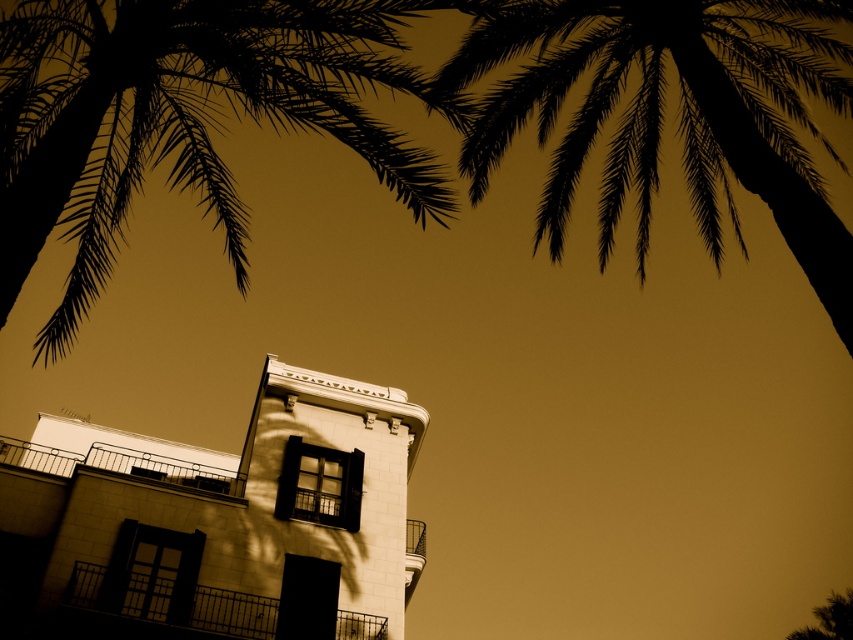
Is silhouette leafy palm at upper left shorter than black silhouette palm tree at upper right?

Indeed, silhouette leafy palm at upper left has a lesser height compared to black silhouette palm tree at upper right.

Is silhouette leafy palm at upper left wider than black silhouette palm tree at upper right?

In fact, silhouette leafy palm at upper left might be narrower than black silhouette palm tree at upper right.

Is point (61, 113) more distant than point (776, 161)?

No, it is not.

Where is `silhouette leafy palm at upper left`? The image size is (853, 640). silhouette leafy palm at upper left is located at coordinates coord(186,116).